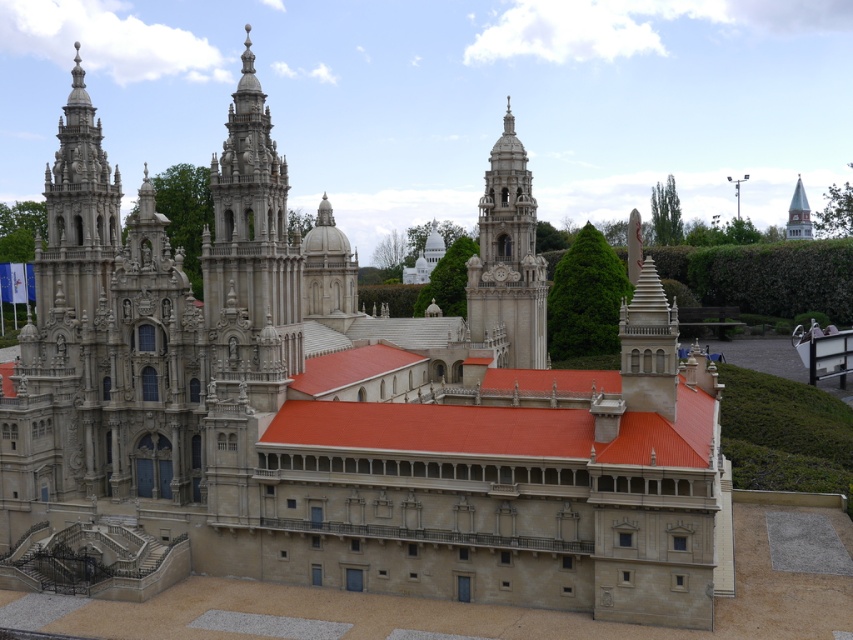
You are standing in front of the miniature cathedral model. Where exactly is the smooth stone tower at center located in terms of coordinates?

The smooth stone tower at center is located at coordinates point (250, 227).

You are an architect examining the miniature cathedral model. You notice the white stone clock tower at center and the smooth white spire at upper right. Which of these two structures is located more to the left in the model?

The white stone clock tower at center is positioned on the left side of smooth white spire at upper right, so it is more to the left.

You are a drone pilot who needs to fly a drone from the point at [33,269] to a point 96.64 meters away. Given that the drone has a maximum flight radius of 100 meters, can you safely complete this mission within the cathedral model?

The distance between the point at [33,269] and the destination is 96.64 meters, which is within the drone pilot maximum flight radius of 100 meters. Yes, the mission can be safely completed.